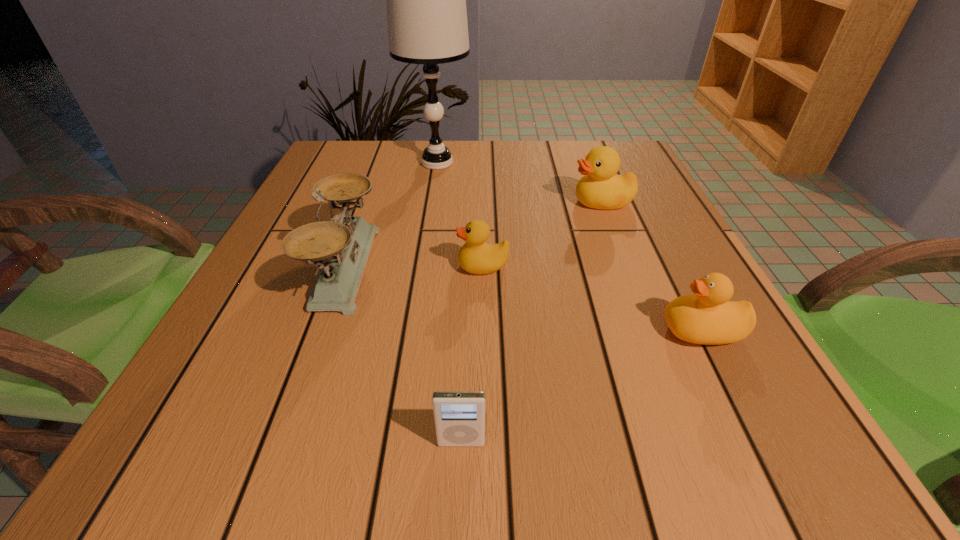
Find the location of `free area in between the nearest duck and the table lamp`. free area in between the nearest duck and the table lamp is located at coordinates (569, 247).

You are a GUI agent. You are given a task and a screenshot of the screen. Output one action in this format:
    pyautogui.click(x=<x>, y=<y>)
    Task: Click on the blank region between the farthest object and the scale
    This screenshot has height=540, width=960.
    Given the screenshot: What is the action you would take?
    pyautogui.click(x=391, y=215)

This screenshot has width=960, height=540. What are the coordinates of `free point between the second farthest duck and the fifth nearest object` in the screenshot? It's located at (542, 234).

In order to click on free space between the second farthest object and the table lamp in this screenshot , I will do `click(519, 183)`.

Find the location of a particular element. vacant region between the leftmost duck and the iPod is located at coordinates (472, 354).

I want to click on blank region between the iPod and the tallest object, so click(449, 303).

The height and width of the screenshot is (540, 960). Find the location of `object that is the third closest one to the farthest duck`. object that is the third closest one to the farthest duck is located at coordinates (707, 317).

Identify the location of object that is the fifth closest to the nearest duck. (426, 0).

The width and height of the screenshot is (960, 540). I want to click on duck identified as the second closest to the second farthest duck, so click(x=707, y=317).

Find the location of a particular element. the closest duck relative to the nearest object is located at coordinates (476, 257).